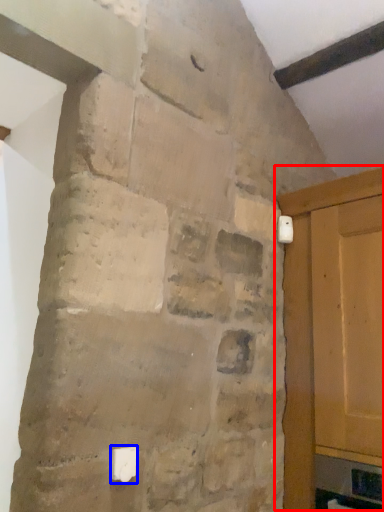
Question: Which object is further to the camera taking this photo, door (highlighted by a red box) or light switch (highlighted by a blue box)?

Choices:
 (A) door
 (B) light switch

Answer: (A)